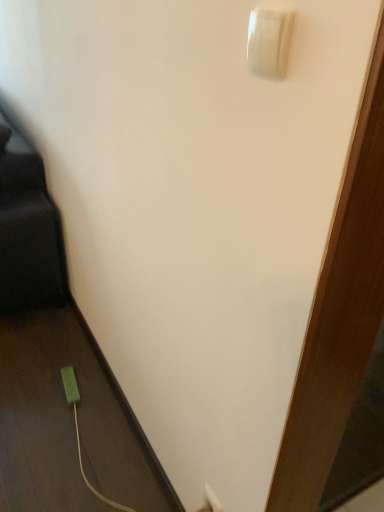
Question: Does white glossy light switch at upper right have a greater height compared to green plastic power plug at lower left?

Choices:
 (A) no
 (B) yes

Answer: (B)

Question: Considering the relative sizes of white glossy light switch at upper right and green plastic power plug at lower left in the image provided, is white glossy light switch at upper right smaller than green plastic power plug at lower left?

Choices:
 (A) yes
 (B) no

Answer: (A)

Question: From a real-world perspective, is white glossy light switch at upper right over green plastic power plug at lower left?

Choices:
 (A) no
 (B) yes

Answer: (B)

Question: Is the depth of white glossy light switch at upper right greater than that of green plastic power plug at lower left?

Choices:
 (A) no
 (B) yes

Answer: (A)

Question: Can you confirm if white glossy light switch at upper right is positioned to the right of green plastic power plug at lower left?

Choices:
 (A) yes
 (B) no

Answer: (A)

Question: Is white glossy light switch at upper right closer to camera compared to green plastic power plug at lower left?

Choices:
 (A) yes
 (B) no

Answer: (A)

Question: Is the position of green plastic power plug at lower left more distant than that of white glossy light switch at upper right?

Choices:
 (A) yes
 (B) no

Answer: (A)

Question: Is green plastic power plug at lower left positioned before white glossy light switch at upper right?

Choices:
 (A) no
 (B) yes

Answer: (A)

Question: Can you confirm if green plastic power plug at lower left is shorter than white glossy light switch at upper right?

Choices:
 (A) yes
 (B) no

Answer: (A)

Question: Is green plastic power plug at lower left aimed at white glossy light switch at upper right?

Choices:
 (A) no
 (B) yes

Answer: (A)

Question: Are green plastic power plug at lower left and white glossy light switch at upper right beside each other?

Choices:
 (A) yes
 (B) no

Answer: (B)

Question: From a real-world perspective, is green plastic power plug at lower left located higher than white glossy light switch at upper right?

Choices:
 (A) no
 (B) yes

Answer: (A)

Question: Is point (64, 390) closer or farther from the camera than point (276, 30)?

Choices:
 (A) closer
 (B) farther

Answer: (B)